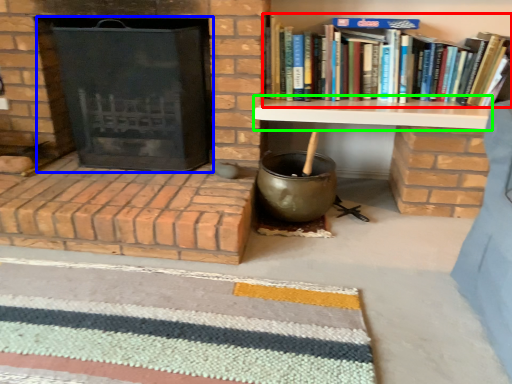
Question: Which object is positioned farthest from book (highlighted by a red box)? Select from fireplace (highlighted by a blue box) and table (highlighted by a green box).

Choices:
 (A) fireplace
 (B) table

Answer: (A)